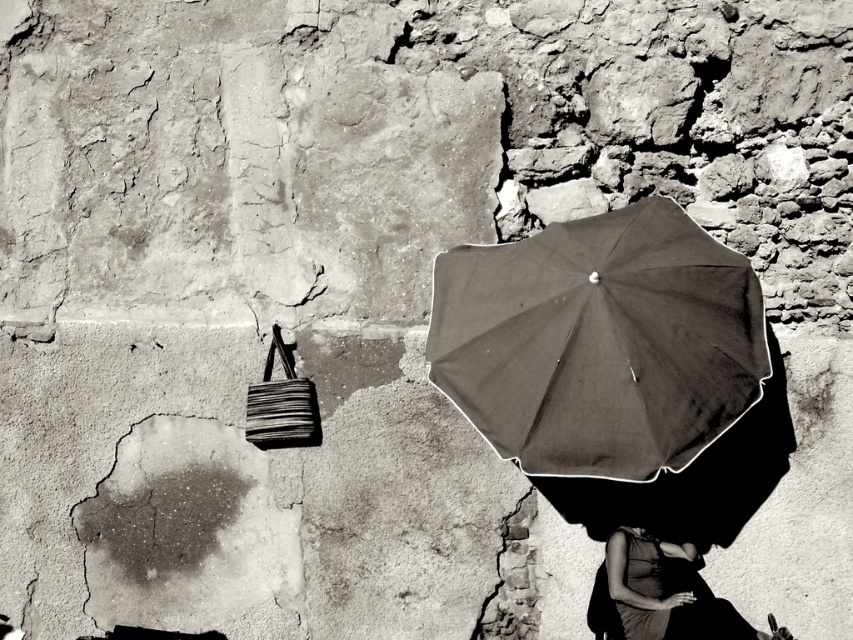
You are standing in front of the stone wall and want to place both the dark matte umbrella at center and the smooth black dress at lower right on the wall. Considering their sizes, which one would you need to move closer to the wall to make them appear the same size in the photo?

The dark matte umbrella at center is larger in size compared to the smooth black dress at lower right. To make them appear the same size in the photo, you would need to move the dark matte umbrella at center farther away from the wall and the smooth black dress at lower right closer to the wall.